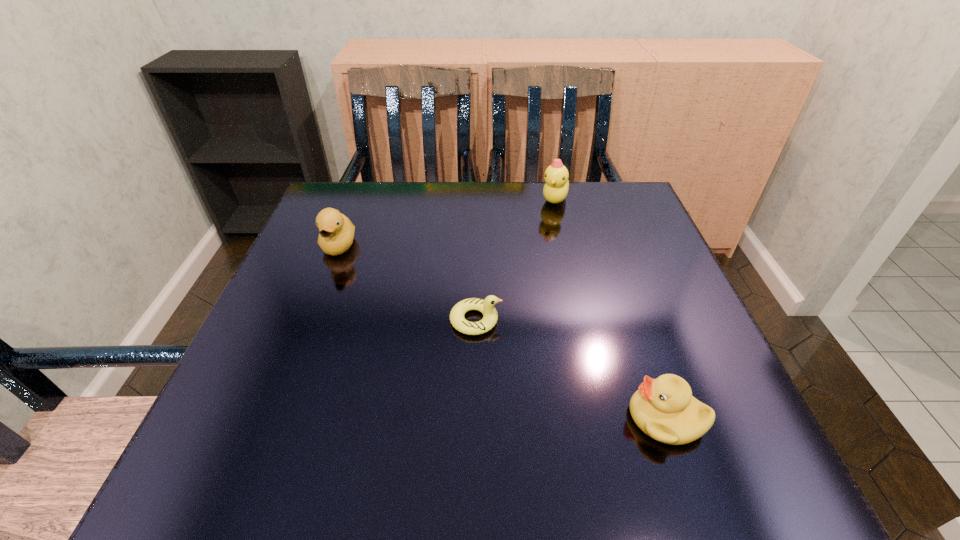
Locate an element on the screen. The width and height of the screenshot is (960, 540). blank space that satisfies the following two spatial constraints: 1. on the front-facing side of the second object from right to left; 2. on the face of the second nearest object is located at coordinates (583, 320).

This screenshot has width=960, height=540. I want to click on vacant space that satisfies the following two spatial constraints: 1. on the front-facing side of the third duckling from left to right; 2. on the face of the second nearest object, so click(583, 320).

I want to click on vacant space that satisfies the following two spatial constraints: 1. on the front-facing side of the farthest duckling; 2. on the face of the shortest object, so click(583, 320).